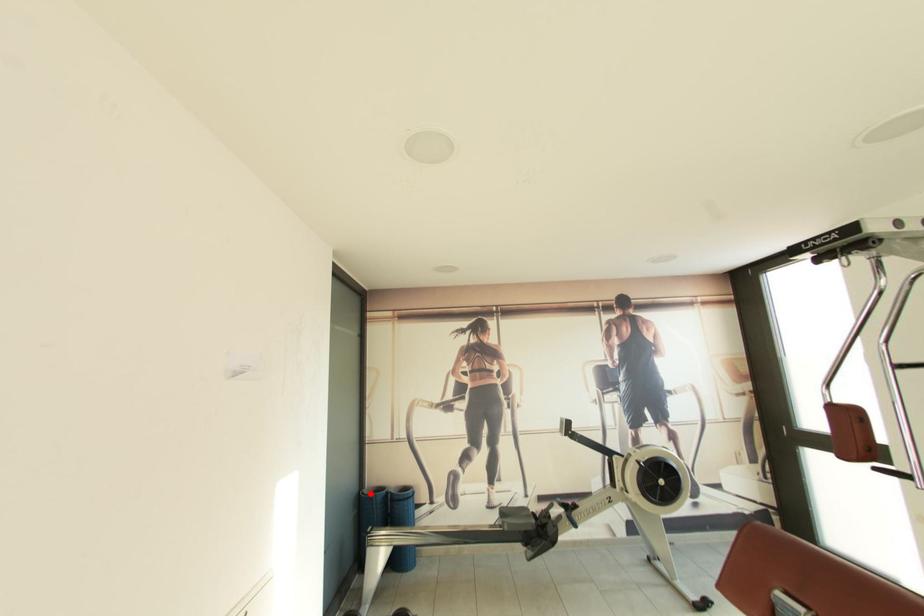
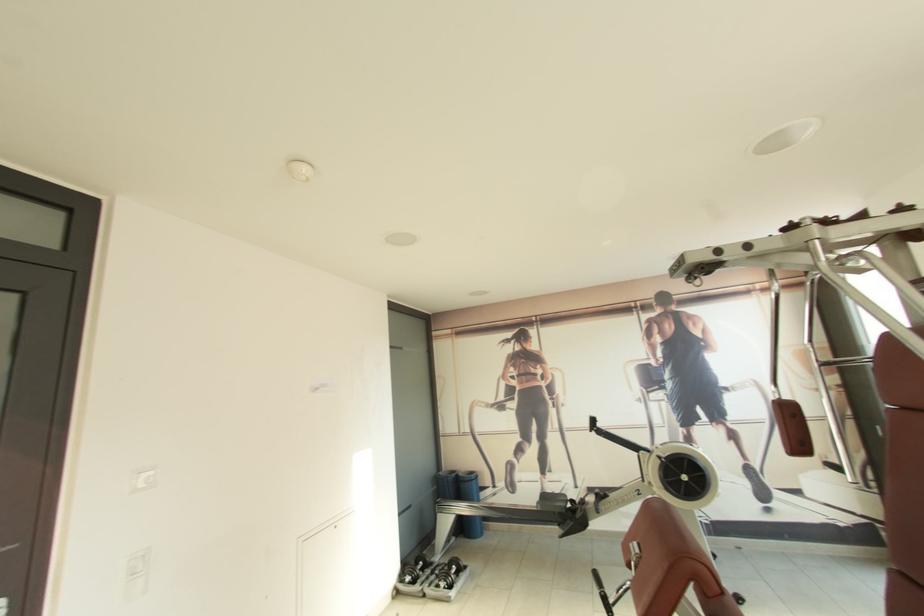
Question: I am providing you with two images of the same scene from different viewpoints. Given a red point in image1, look at the same physical point in image2. Is it:

Choices:
 (A) Closer to the viewpoint
 (B) Farther from the viewpoint

Answer: (B)